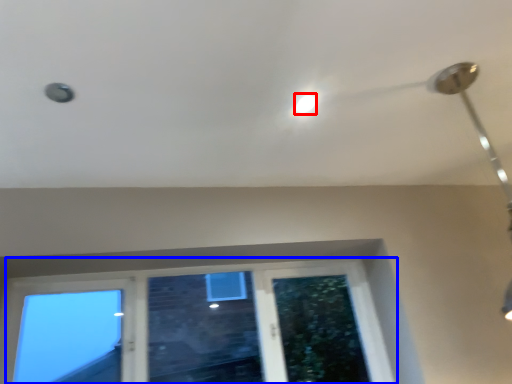
Question: Which object appears farthest to the camera in this image, droplight (highlighted by a red box) or window (highlighted by a blue box)?

Choices:
 (A) droplight
 (B) window

Answer: (B)